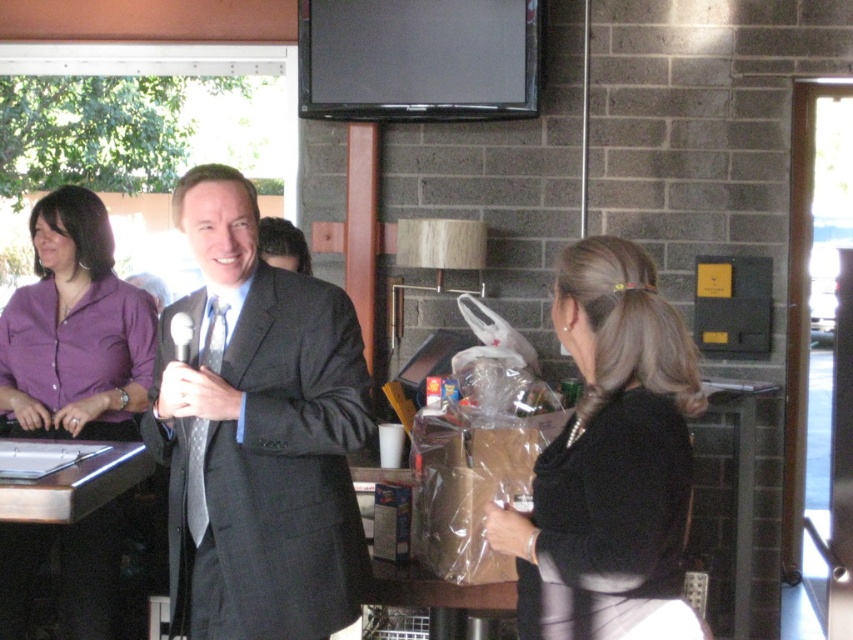
Is point (209, 429) farther from camera compared to point (614, 444)?

That is True.

Identify the location of matte black suit at center. Image resolution: width=853 pixels, height=640 pixels. (258, 433).

Can you confirm if black satin dress at center is bigger than purple satin blouse at left?

Incorrect, black satin dress at center is not larger than purple satin blouse at left.

This screenshot has width=853, height=640. I want to click on black satin dress at center, so click(610, 461).

Does matte black suit at center have a greater width compared to purple satin blouse at left?

Yes.

Between matte black suit at center and purple satin blouse at left, which one has less height?

matte black suit at center is shorter.

Image resolution: width=853 pixels, height=640 pixels. Describe the element at coordinates (258, 433) in the screenshot. I see `matte black suit at center` at that location.

Identify the location of matte black suit at center. The image size is (853, 640). (258, 433).